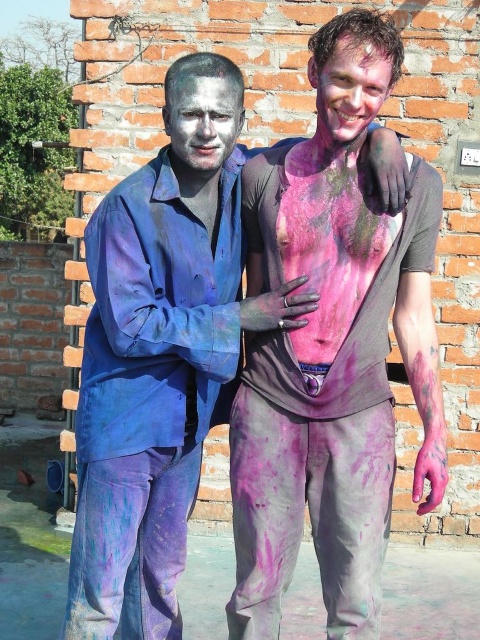
Between point (191, 228) and point (178, 150), which one is positioned behind?

The point (191, 228) is behind.

Between multicolored paint-covered body at center and white matte face at center, which one appears on the right side from the viewer's perspective?

white matte face at center is more to the right.

Which is in front, point (92, 432) or point (170, 145)?

Point (92, 432)

Find the location of a particular element. The height and width of the screenshot is (640, 480). multicolored paint-covered body at center is located at coordinates (154, 387).

Is point (264, 426) positioned in front of point (202, 129)?

That is False.

Is purple matte pants at lower left smaller than white matte face at center?

No, purple matte pants at lower left is not smaller than white matte face at center.

You are a GUI agent. You are given a task and a screenshot of the screen. Output one action in this format:
    pyautogui.click(x=<x>, y=<y>)
    Task: Click on the purple matte pants at lower left
    The image size is (480, 640).
    Given the screenshot: What is the action you would take?
    pyautogui.click(x=332, y=349)

In the scene shown: Can you confirm if white matte face at center is positioned below matte pink paint at center?

Indeed, white matte face at center is positioned under matte pink paint at center.

Which of these two, white matte face at center or matte pink paint at center, stands shorter?

white matte face at center

Find the location of a particular element. The width and height of the screenshot is (480, 640). white matte face at center is located at coordinates (202, 122).